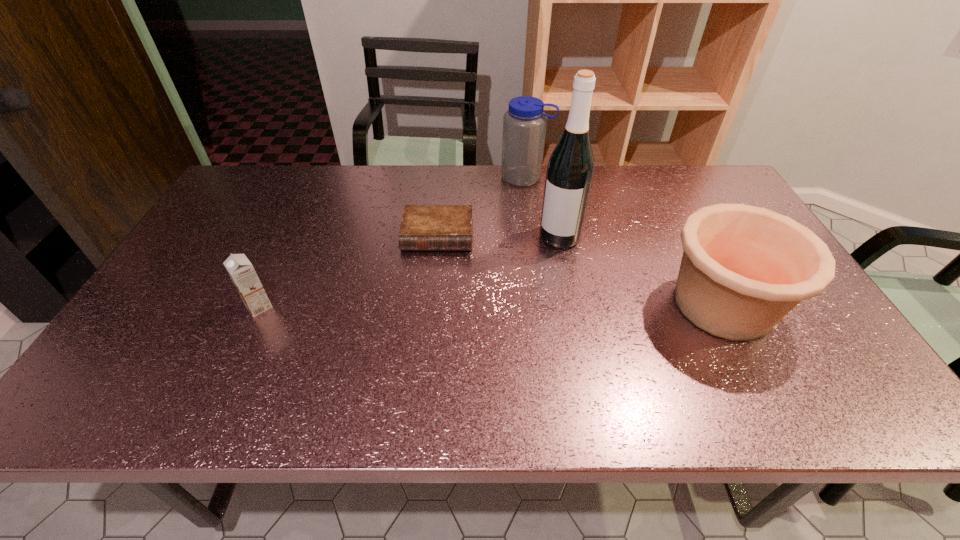
Locate an element on the screen. Image resolution: width=960 pixels, height=540 pixels. the leftmost object is located at coordinates (239, 268).

What are the coordinates of `chocolate milk` in the screenshot? It's located at pyautogui.click(x=239, y=268).

Locate an element on the screen. This screenshot has height=540, width=960. the rightmost object is located at coordinates click(x=744, y=268).

Where is `pottery`? pottery is located at coordinates (744, 268).

Where is `water bottle`? This screenshot has height=540, width=960. water bottle is located at coordinates (524, 125).

You are a GUI agent. You are given a task and a screenshot of the screen. Output one action in this format:
    pyautogui.click(x=<x>, y=<y>)
    Task: Click on the second tallest object
    This screenshot has height=540, width=960.
    Given the screenshot: What is the action you would take?
    pyautogui.click(x=524, y=125)

Identify the location of diary. (423, 227).

The width and height of the screenshot is (960, 540). I want to click on the second object from left to right, so click(x=423, y=227).

You are a GUI agent. You are given a task and a screenshot of the screen. Output one action in this format:
    pyautogui.click(x=<x>, y=<y>)
    Task: Click on the wine bottle
    The image size is (960, 540).
    Given the screenshot: What is the action you would take?
    pyautogui.click(x=570, y=170)

The image size is (960, 540). Identify the location of free space located on the back of the leftmost object. [x=299, y=222].